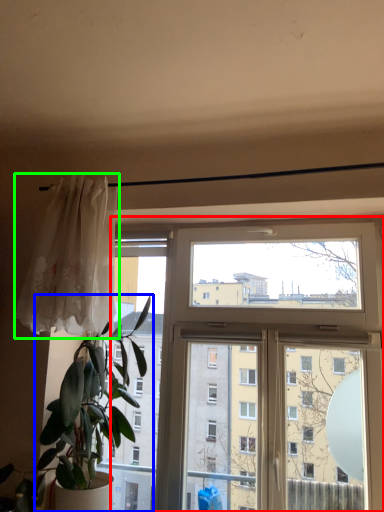
Question: Based on their relative distances, which object is farther from window (highlighted by a red box)? Choose from houseplant (highlighted by a blue box) and curtain (highlighted by a green box).

Choices:
 (A) houseplant
 (B) curtain

Answer: (B)